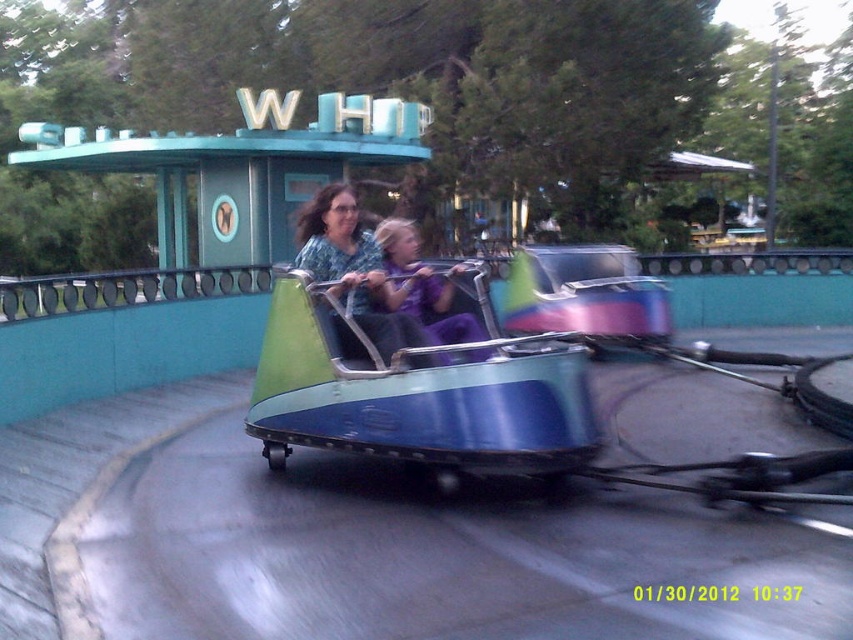
In the scene shown: You are standing at the entrance of the Whirl ride and see the matte green car at center and the purple fabric at center. If you want to place a 30 cm wide banner between them, will there be enough space?

The matte green car at center is 33.01 centimeters from purple fabric at center. Since the distance between them is greater than the banner width, the banner can be placed between them.

You are a fairground attendant and need to ensure that the bumper car ride can accommodate a new safety barrier. The barrier requires a minimum width of 2 meters. Given the information provided, can the matte green car at center and the purple fabric at center be positioned side by side without exceeding the required width?

The matte green car at center might be wider than purple fabric at center, so it is uncertain whether their combined width would exceed the 2 meter requirement. Further measurements are needed to confirm.

You are at the fairground and want to take a photo of the bumper car ride. The matte green car at center and the purple fabric at center are both in your viewfinder. Which object should you focus on if you want to capture the taller one in your photo?

The matte green car at center is taller than the purple fabric at center, so you should focus on the matte green car at center to capture the taller object in your photo.